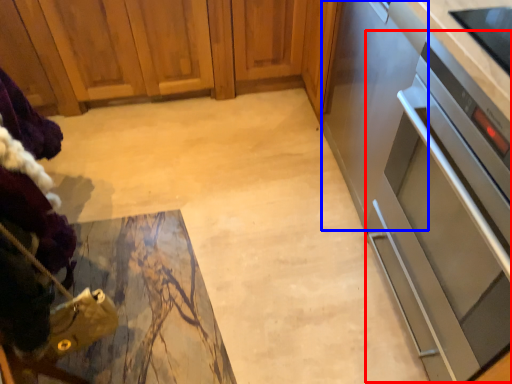
Question: Which object is closer to the camera taking this photo, oven (highlighted by a red box) or appliance (highlighted by a blue box)?

Choices:
 (A) oven
 (B) appliance

Answer: (A)